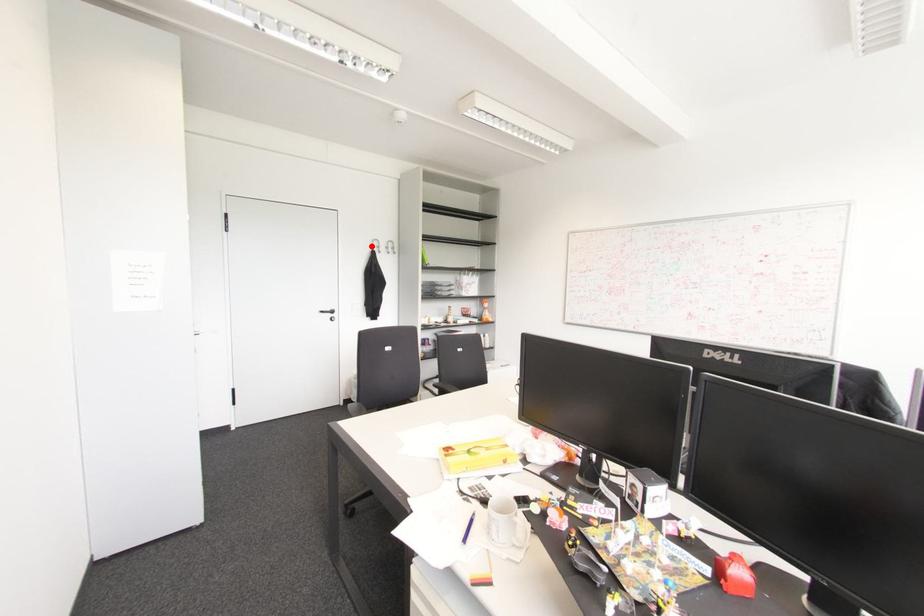
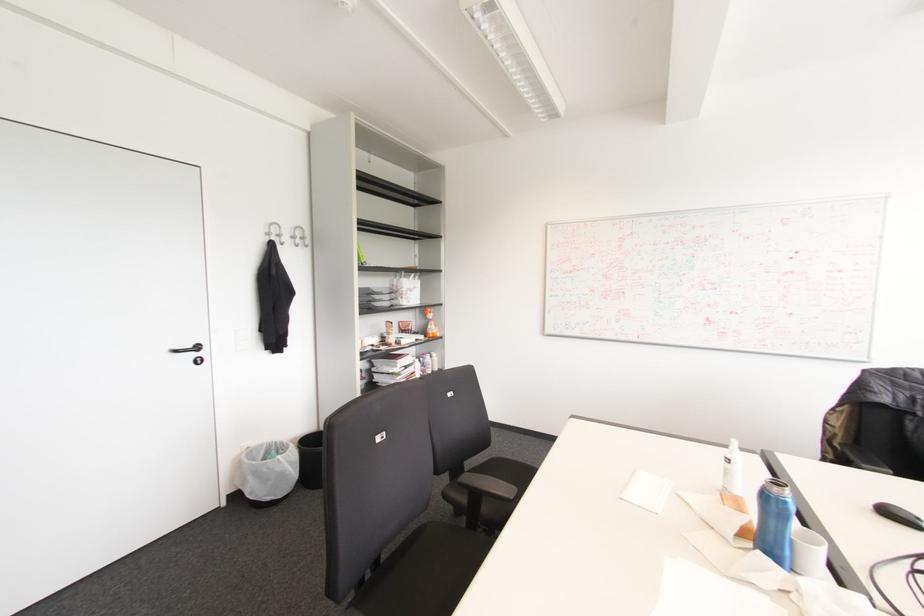
In the second image, find the point that corresponds to the highlighted location in the first image.

(266, 233)